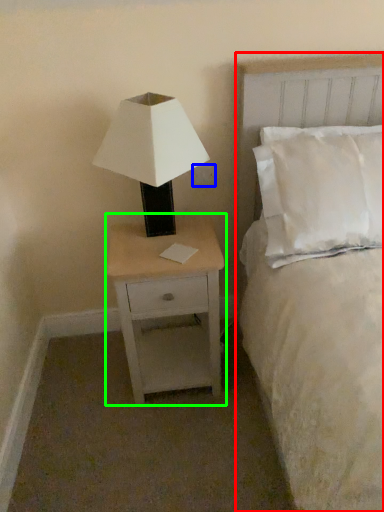
Question: Considering the real-world distances, which object is closest to bed (highlighted by a red box)? electric outlet (highlighted by a blue box) or nightstand (highlighted by a green box).

Choices:
 (A) electric outlet
 (B) nightstand

Answer: (B)